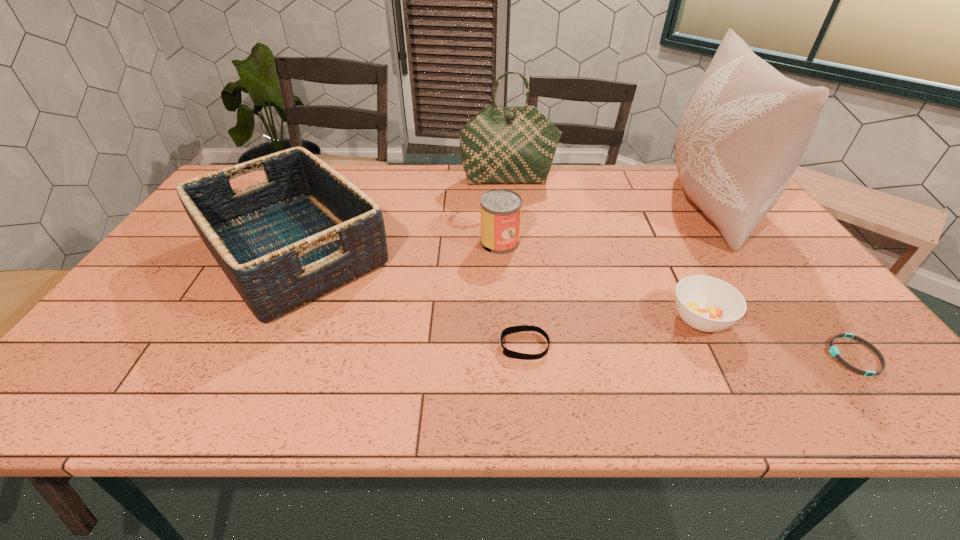
Locate an element on the screen. object that is positioned at the far left corner is located at coordinates (304, 231).

Identify the location of object present at the far right corner. (745, 128).

Identify the location of object present at the near right corner. This screenshot has width=960, height=540. (833, 350).

Locate an element on the screen. free space at the far edge is located at coordinates (594, 169).

This screenshot has width=960, height=540. Identify the location of free space at the near edge. (358, 379).

In the image, there is a desktop. Identify the location of vacant space at the right edge. (775, 237).

I want to click on free region at the far left corner of the desktop, so click(x=245, y=177).

I want to click on blank region between the basket and the fourth shortest object, so click(x=396, y=247).

Identify the location of empty location between the tallest object and the soup bowl. The height and width of the screenshot is (540, 960). (704, 262).

Where is `vacant point located between the soup bowl and the taller wristband`? This screenshot has height=540, width=960. vacant point located between the soup bowl and the taller wristband is located at coordinates (612, 333).